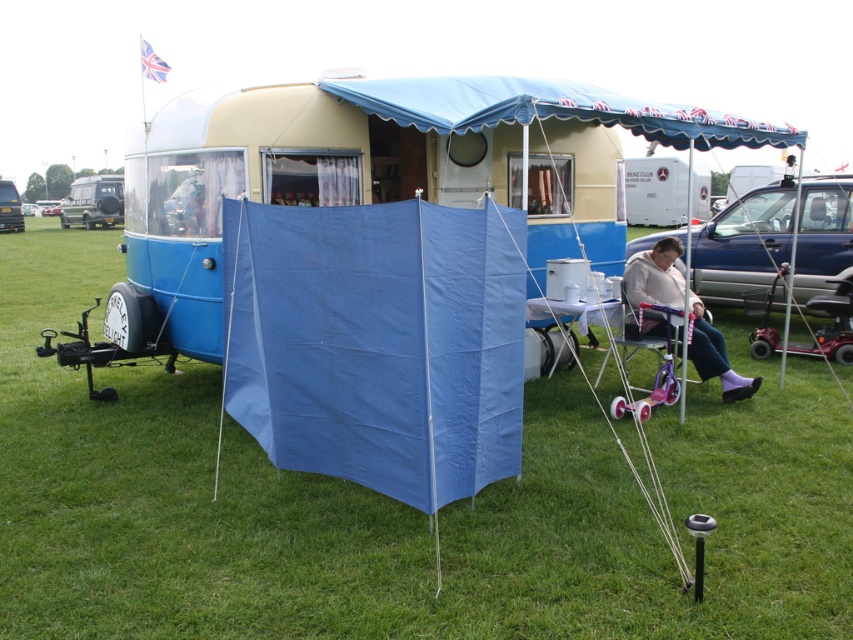
You are planning to set up a picnic area between the blue fabric tent at center and the white plastic food truck at upper center. The picnic blanket you have is 5 meters long. Will the blanket reach from the tent to the food truck?

The blue fabric tent at center is 8.13 meters away from the white plastic food truck at upper center. Since the picnic blanket is only 5 meters long, it will not be sufficient to cover the distance between them.

You are planning to set up a small garden between the blue fabric trailer at center and the light beige sweater at center. The garden requires a space of 3 meters. Is there enough space between them to accommodate it?

The distance between the blue fabric trailer at center and the light beige sweater at center is 3.67 meters, which is more than the required 3 meters. Therefore, there is enough space to set up the garden between them.

Looking at this image, you are planning to take a photo of the blue fabric trailer at center and the light beige sweater at center. Which object should you focus on first if you want to capture both in the same frame without moving the camera?

You should focus on the blue fabric trailer at center first because it is larger and will require more space in the frame compared to the smaller light beige sweater at center to ensure both are visible.